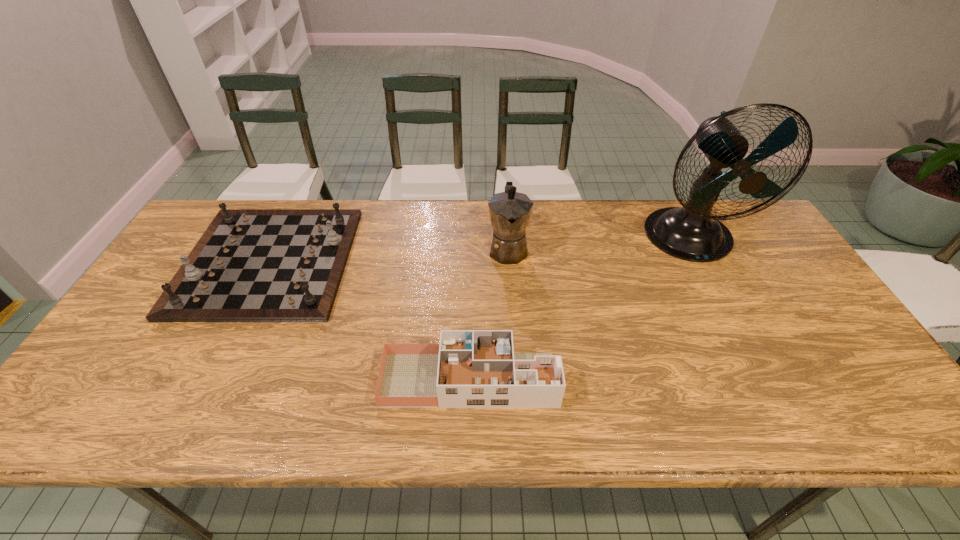
This screenshot has height=540, width=960. Find the location of `the tallest object`. the tallest object is located at coordinates (690, 233).

Find the location of a particular element. Image resolution: width=960 pixels, height=540 pixels. the rightmost object is located at coordinates (690, 233).

Image resolution: width=960 pixels, height=540 pixels. I want to click on the second tallest object, so click(510, 211).

You are a GUI agent. You are given a task and a screenshot of the screen. Output one action in this format:
    pyautogui.click(x=<x>, y=<y>)
    Task: Click on the leftmost object
    
    Given the screenshot: What is the action you would take?
    pyautogui.click(x=251, y=265)

Locate an element on the screen. Image resolution: width=960 pixels, height=540 pixels. the nearest object is located at coordinates (469, 368).

The image size is (960, 540). Find the location of `vacant space situated 0.160m on the front-facing side of the fan`. vacant space situated 0.160m on the front-facing side of the fan is located at coordinates coord(731,316).

Locate an element on the screen. This screenshot has height=540, width=960. vacant area situated 0.210m on the pouring side of the second tallest object is located at coordinates (514, 328).

What are the coordinates of `free location located 0.250m on the board of the chessboard` in the screenshot? It's located at (432, 261).

Image resolution: width=960 pixels, height=540 pixels. Identify the location of free location located at the front door of the nearest object. (725, 380).

You are a GUI agent. You are given a task and a screenshot of the screen. Output one action in this format:
    pyautogui.click(x=<x>, y=<y>)
    Task: Click on the fan located in the far edge section of the desktop
    
    Given the screenshot: What is the action you would take?
    tap(690, 233)